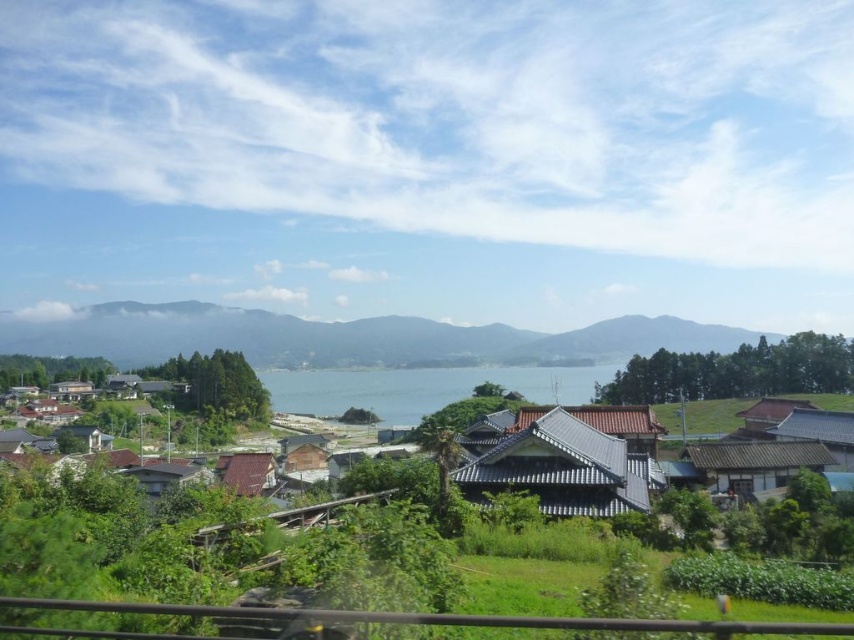
Question: Which object appears closest to the camera in this image?

Choices:
 (A) brown tile roof hut at lower right
 (B) brown tiled roofs at center
 (C) clear water at center

Answer: (B)

Question: Does green grassy hillside at center appear under clear water at center?

Choices:
 (A) yes
 (B) no

Answer: (B)

Question: Based on their relative distances, which object is farther from the brown tile roof hut at lower right?

Choices:
 (A) brown tiled roofs at center
 (B) brown tile roof at lower left
 (C) green grassy hillside at center

Answer: (C)

Question: Can you confirm if gray tile roof hut at center is thinner than brown tiled roofs at center?

Choices:
 (A) yes
 (B) no

Answer: (A)

Question: Which object is positioned closest to the gray tile roof hut at center?

Choices:
 (A) brown tile roof hut at lower right
 (B) brown tiled roofs at center

Answer: (A)

Question: Is brown tiled roofs at center positioned before brown tile roof at lower left?

Choices:
 (A) yes
 (B) no

Answer: (B)